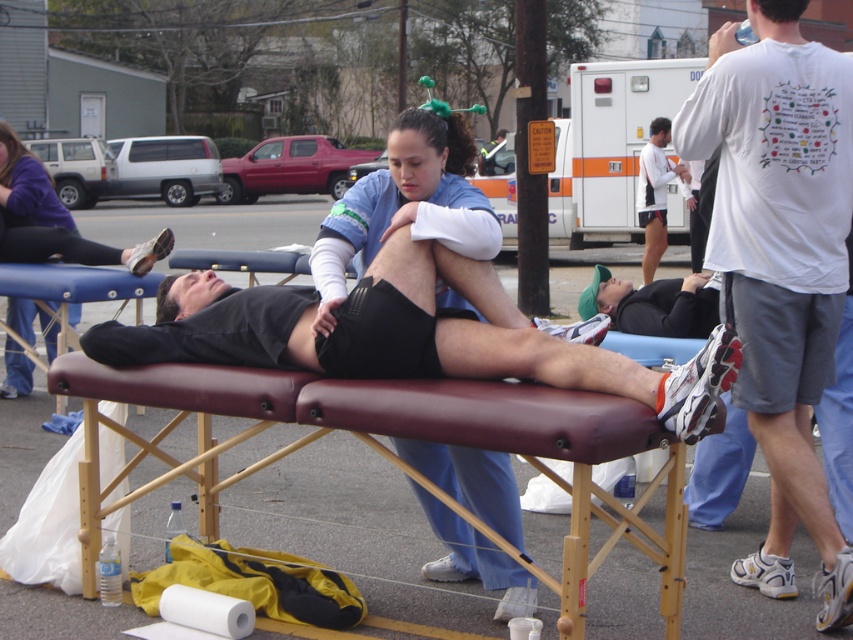
You are standing at the point marked as point (433, 440) in the image. What object is directly in front of you?

The maroon leather stretcher at center is directly in front of you at point (433, 440).

You are a photographer setting up for a group photo. You need to position yourself so that both the matte black leg at upper left and the black matte shirt at lower right are visible in your frame. Based on their positions, where should you stand relative to the scene?

You should position yourself below the scene so that the matte black leg at upper left, which is above the black matte shirt at lower right, can be captured in the frame along with the black matte shirt at lower right.

You are a physical therapist trying to place a 2.3 meter long exercise mat between the white matte athletic shoe at lower center and the black matte shirt at lower right. Can you fit the mat horizontally between them?

The white matte athletic shoe at lower center and black matte shirt at lower right are 2.41 meters apart, so yes, the 2.3 meter exercise mat can fit horizontally between them since it is slightly shorter than the distance between the two objects.